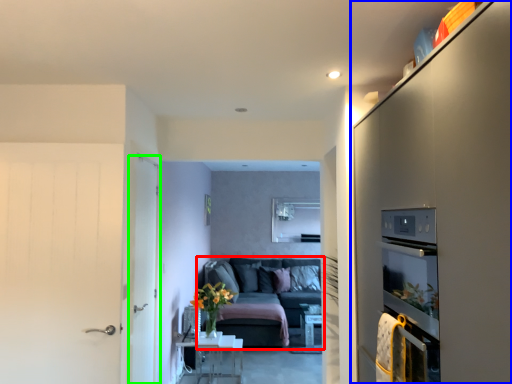
Question: Estimate the real-world distances between objects in this image. Which object is closer to studio couch (highlighted by a red box), cabinetry (highlighted by a blue box) or door (highlighted by a green box)?

Choices:
 (A) cabinetry
 (B) door

Answer: (B)